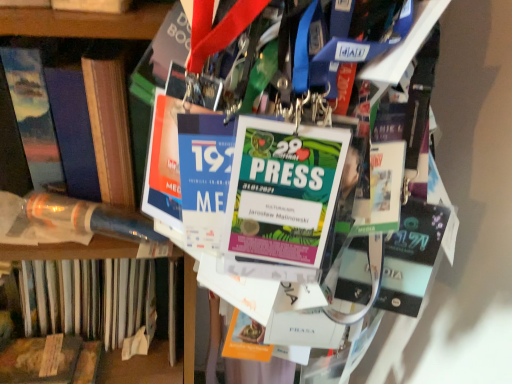
Question: From the image's perspective, is translucent plastic tube at left, the third book viewed from the right, beneath hardcover book at left, the first book when ordered from right to left?

Choices:
 (A) no
 (B) yes

Answer: (B)

Question: Does translucent plastic tube at left, the third book viewed from the right, have a larger size compared to hardcover book at left, the first book when ordered from right to left?

Choices:
 (A) yes
 (B) no

Answer: (B)

Question: Considering the relative sizes of translucent plastic tube at left, the third book viewed from the right, and hardcover book at left, arranged as the 4th book when viewed from the left, in the image provided, is translucent plastic tube at left, the third book viewed from the right, thinner than hardcover book at left, arranged as the 4th book when viewed from the left,?

Choices:
 (A) no
 (B) yes

Answer: (B)

Question: From a real-world perspective, is translucent plastic tube at left, the third book viewed from the right, beneath hardcover book at left, arranged as the 4th book when viewed from the left?

Choices:
 (A) no
 (B) yes

Answer: (B)

Question: Does translucent plastic tube at left, the third book viewed from the right, have a greater height compared to hardcover book at left, arranged as the 4th book when viewed from the left?

Choices:
 (A) yes
 (B) no

Answer: (B)

Question: Is translucent plastic tube at left, the third book viewed from the right, positioned before hardcover book at left, the first book when ordered from right to left?

Choices:
 (A) no
 (B) yes

Answer: (A)

Question: Considering the relative sizes of matte blue book at left, the 2th book in the right-to-left sequence, and hardcover book at left, the first book when ordered from right to left, in the image provided, is matte blue book at left, the 2th book in the right-to-left sequence, thinner than hardcover book at left, the first book when ordered from right to left,?

Choices:
 (A) yes
 (B) no

Answer: (A)

Question: Is matte blue book at left, the 2th book in the right-to-left sequence, completely or partially outside of hardcover book at left, arranged as the 4th book when viewed from the left?

Choices:
 (A) no
 (B) yes

Answer: (B)

Question: From the image's perspective, is matte blue book at left, the 2th book in the right-to-left sequence, below hardcover book at left, arranged as the 4th book when viewed from the left?

Choices:
 (A) yes
 (B) no

Answer: (B)

Question: From the image's perspective, does matte blue book at left, the 2th book in the right-to-left sequence, appear higher than hardcover book at left, arranged as the 4th book when viewed from the left?

Choices:
 (A) no
 (B) yes

Answer: (B)

Question: Can you confirm if matte blue book at left, positioned as the 3th book in left-to-right order, is positioned to the left of hardcover book at left, the first book when ordered from right to left?

Choices:
 (A) yes
 (B) no

Answer: (A)

Question: From a real-world perspective, is matte blue book at left, positioned as the 3th book in left-to-right order, under hardcover book at left, the first book when ordered from right to left?

Choices:
 (A) yes
 (B) no

Answer: (B)

Question: From the image's perspective, would you say hardcover book at left, the first book when ordered from right to left, is positioned over matte blue book at left, the 2th book in the right-to-left sequence?

Choices:
 (A) no
 (B) yes

Answer: (A)